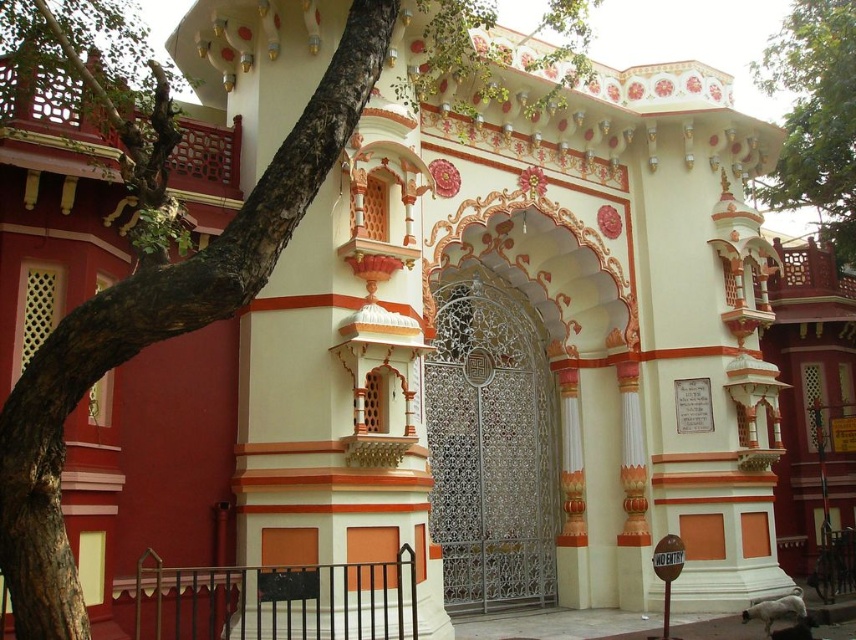
Who is positioned more to the left, white metal gate at center or green leafy tree at upper right?

white metal gate at center

Can you confirm if white metal gate at center is smaller than green leafy tree at upper right?

Indeed, white metal gate at center has a smaller size compared to green leafy tree at upper right.

What do you see at coordinates (491, 451) in the screenshot? I see `white metal gate at center` at bounding box center [491, 451].

This screenshot has height=640, width=856. Identify the location of white metal gate at center. (491, 451).

Who is positioned more to the left, brown rough bark at center left or white metal gate at center?

brown rough bark at center left

Is brown rough bark at center left further to camera compared to white metal gate at center?

No, it is in front of white metal gate at center.

Is point (232, 237) in front of point (435, 472)?

Yes, it is.

Image resolution: width=856 pixels, height=640 pixels. What are the coordinates of `brown rough bark at center left` in the screenshot? It's located at (153, 292).

Based on the photo, does brown rough bark at center left have a lesser height compared to green leafy tree at upper right?

Yes, brown rough bark at center left is shorter than green leafy tree at upper right.

Can you confirm if brown rough bark at center left is positioned to the right of green leafy tree at upper right?

No, brown rough bark at center left is not to the right of green leafy tree at upper right.

The height and width of the screenshot is (640, 856). In order to click on brown rough bark at center left in this screenshot , I will do `click(153, 292)`.